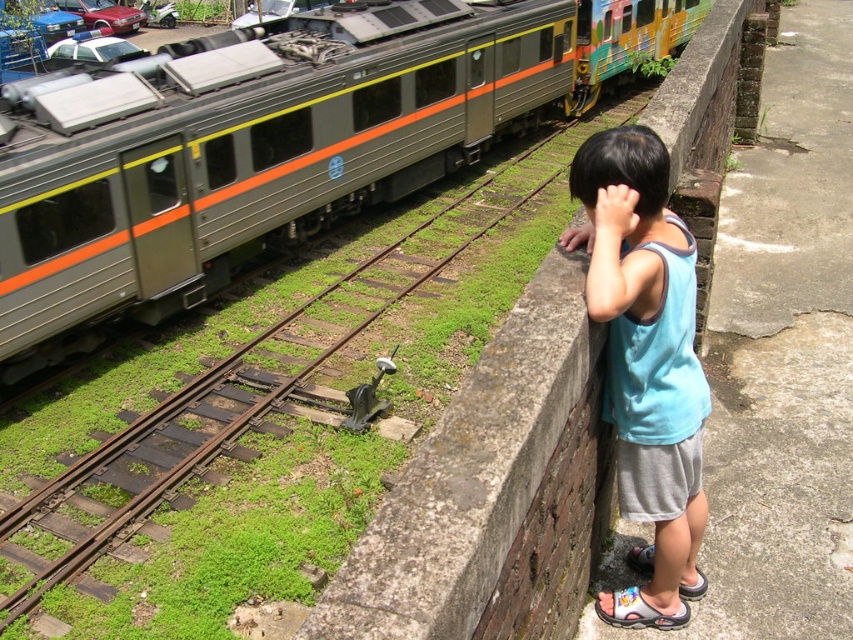
Question: From the image, what is the correct spatial relationship of metallic gray train at upper left in relation to blue cotton tank top at upper right?

Choices:
 (A) below
 (B) above

Answer: (B)

Question: Which of the following is the closest to the observer?

Choices:
 (A) metallic gray train at upper left
 (B) blue cotton tank top at upper right

Answer: (B)

Question: Can you confirm if metallic gray train at upper left is smaller than blue cotton tank top at upper right?

Choices:
 (A) yes
 (B) no

Answer: (B)

Question: Can you confirm if metallic gray train at upper left is positioned to the left of blue cotton tank top at upper right?

Choices:
 (A) no
 (B) yes

Answer: (B)

Question: Which of the following is the farthest from the observer?

Choices:
 (A) (660, 572)
 (B) (165, 166)

Answer: (B)